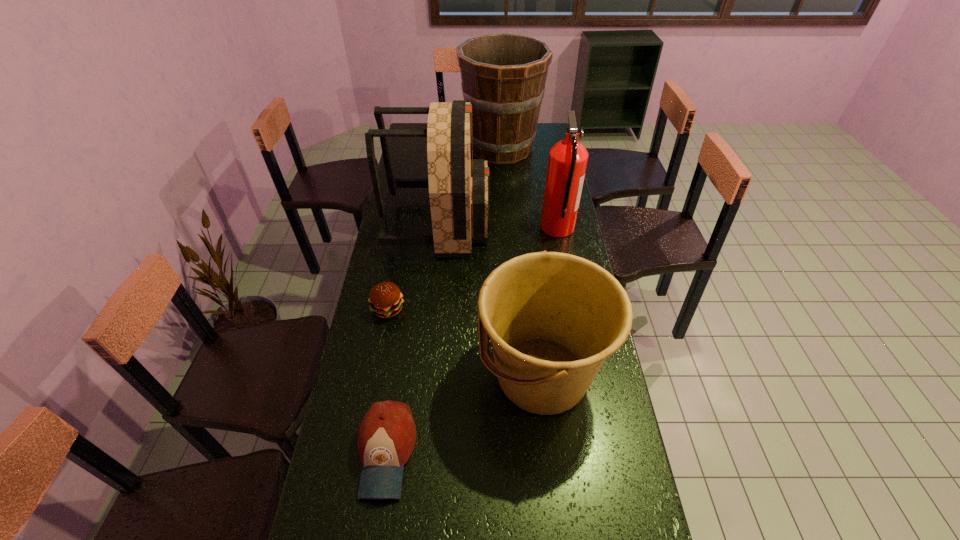
Identify the location of vacant region located 0.210m at the nozzle of the fire extinguisher. (489, 228).

Where is `free space located at the nozzle of the fire extinguisher`? The width and height of the screenshot is (960, 540). free space located at the nozzle of the fire extinguisher is located at coordinates (482, 228).

Identify the location of vacant space located at the nozzle of the fire extinguisher. (526, 228).

Image resolution: width=960 pixels, height=540 pixels. Identify the location of vacant space situated 0.320m on the side of the third shortest object with the handle. (371, 376).

Locate an element on the screen. This screenshot has height=540, width=960. vacant area situated 0.080m on the side of the third shortest object with the handle is located at coordinates (451, 376).

Locate an element on the screen. The height and width of the screenshot is (540, 960). blank space located 0.360m on the side of the third shortest object with the handle is located at coordinates (357, 376).

At what (x,y) coordinates should I click in order to perform the action: click on free space located 0.270m on the right of the third nearest object. Please return your answer as a coordinate pair (x, y). The height and width of the screenshot is (540, 960). Looking at the image, I should click on (485, 309).

Locate an element on the screen. object that is at the far edge is located at coordinates (503, 75).

The width and height of the screenshot is (960, 540). In order to click on backpack present at the left edge in this screenshot , I will do `click(458, 185)`.

Find the location of `baseball cap present at the left edge`. baseball cap present at the left edge is located at coordinates (387, 434).